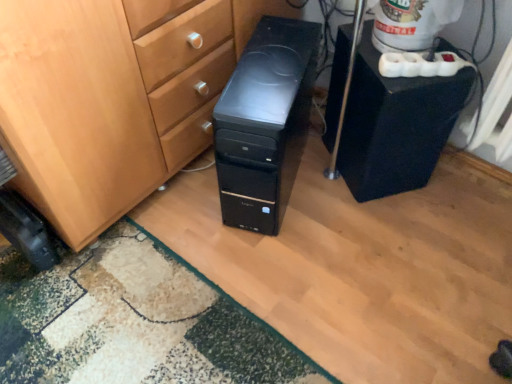
You are a GUI agent. You are given a task and a screenshot of the screen. Output one action in this format:
    pyautogui.click(x=<x>, y=<y>)
    Task: Click on the vacant area that is situated to the right of black plastic computer tower at center
    
    Given the screenshot: What is the action you would take?
    pyautogui.click(x=370, y=203)